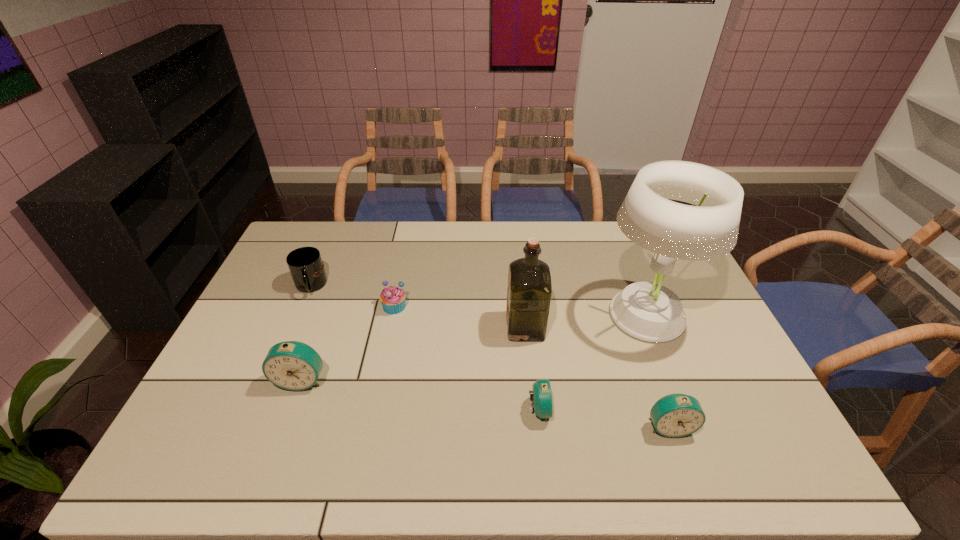
You are a GUI agent. You are given a task and a screenshot of the screen. Output one action in this format:
    pyautogui.click(x=<x>, y=<y>)
    Task: Click on the free spot located on the label of the liquor
    
    Given the screenshot: What is the action you would take?
    pyautogui.click(x=396, y=326)

Find the location of `vacant area situated on the label of the liquor`. vacant area situated on the label of the liquor is located at coordinates (417, 326).

The width and height of the screenshot is (960, 540). What are the coordinates of `free location located on the front of the muffin` in the screenshot? It's located at (374, 400).

This screenshot has width=960, height=540. What are the coordinates of `vacant space positioned 0.380m with the handle on the side of the mug` in the screenshot? It's located at (259, 404).

The height and width of the screenshot is (540, 960). What are the coordinates of `vacant area situated on the front-facing side of the tallest object` in the screenshot? It's located at point(522,314).

At what (x,y) coordinates should I click in order to perform the action: click on vacant space located 0.100m on the front-facing side of the tallest object. Please return your answer as a coordinate pair (x, y). Looking at the image, I should click on (564, 314).

Locate an element on the screen. The image size is (960, 540). free space located 0.210m on the front-facing side of the tallest object is located at coordinates click(529, 314).

I want to click on object situated at the left edge, so click(305, 264).

At what (x,y) coordinates should I click in order to perform the action: click on object at the right edge. Please return your answer as a coordinate pair (x, y). Looking at the image, I should click on (648, 311).

In the image, there is a desktop. Where is `free space at the far edge`? free space at the far edge is located at coordinates point(572,241).